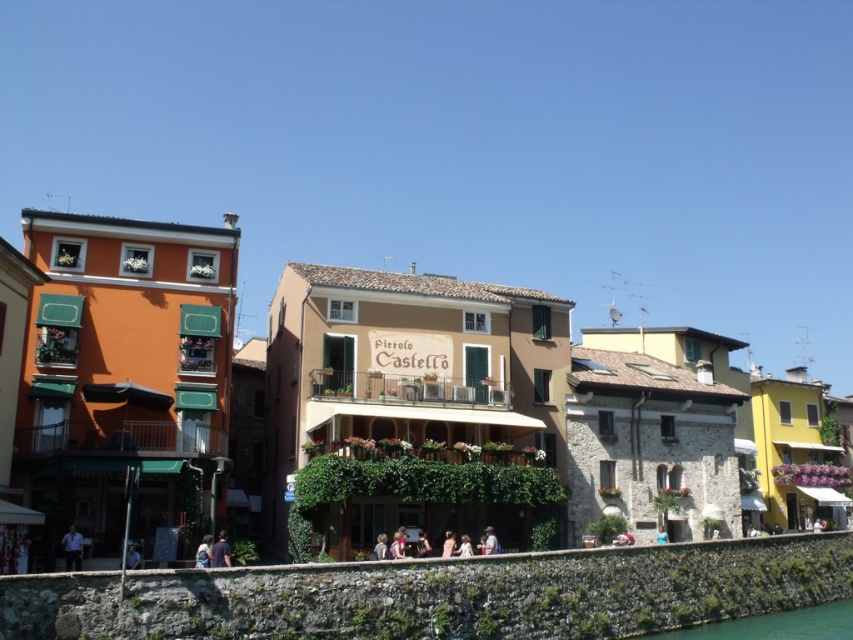
From the picture: Does green liquid water at lower center appear over blue fabric person at lower left?

No.

Can you confirm if green liquid water at lower center is bigger than blue fabric person at lower left?

Indeed, green liquid water at lower center has a larger size compared to blue fabric person at lower left.

Describe the element at coordinates (775, 625) in the screenshot. This screenshot has width=853, height=640. I see `green liquid water at lower center` at that location.

I want to click on green liquid water at lower center, so click(775, 625).

How far apart are light blue denim jacket at lower left and light brown leather jacket at center?

light blue denim jacket at lower left and light brown leather jacket at center are 56.83 feet apart.

Which of these two, light blue denim jacket at lower left or light brown leather jacket at center, stands taller?

light blue denim jacket at lower left

This screenshot has width=853, height=640. In order to click on light blue denim jacket at lower left in this screenshot , I will do `click(202, 552)`.

Between point (788, 620) and point (498, 548), which one is positioned in front?

Point (498, 548)

Who is more distant from viewer, (x=737, y=636) or (x=492, y=529)?

Positioned behind is point (x=492, y=529).

You are a GUI agent. You are given a task and a screenshot of the screen. Output one action in this format:
    pyautogui.click(x=<x>, y=<y>)
    Task: Click on the green liquid water at lower center
    
    Given the screenshot: What is the action you would take?
    pyautogui.click(x=775, y=625)